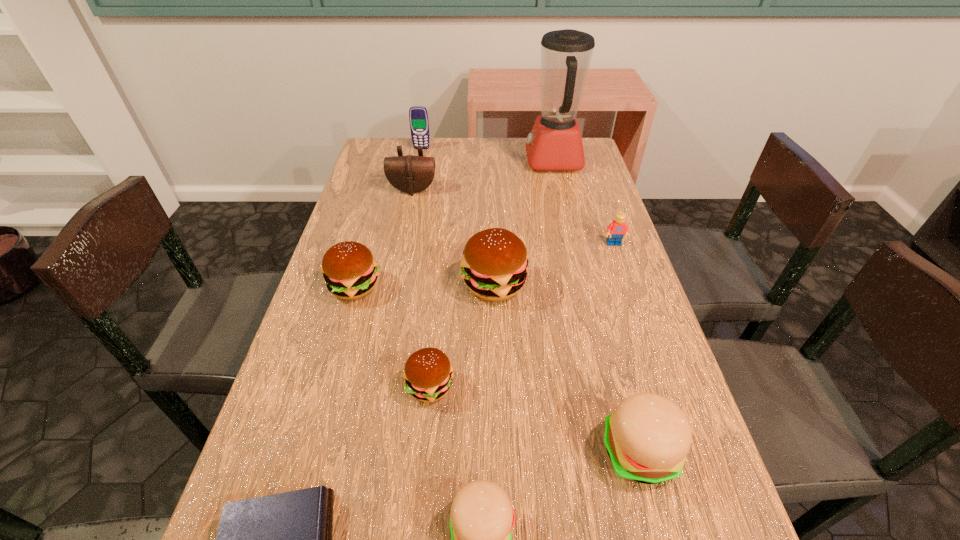
This screenshot has width=960, height=540. What are the coordinates of `the seventh nearest object` in the screenshot? It's located at [617, 228].

You are a GUI agent. You are given a task and a screenshot of the screen. Output one action in this format:
    pyautogui.click(x=<x>, y=<y>)
    Task: Click on the nearest brown hamburger
    The width and height of the screenshot is (960, 540).
    Given the screenshot: What is the action you would take?
    click(x=428, y=374)

The width and height of the screenshot is (960, 540). Find the location of `the smallest brown hamburger`. the smallest brown hamburger is located at coordinates (428, 374).

Where is `free space located on the front of the blender near the controls`? The width and height of the screenshot is (960, 540). free space located on the front of the blender near the controls is located at coordinates (487, 161).

The height and width of the screenshot is (540, 960). What are the coordinates of `blank space located on the front of the blender near the controls` in the screenshot? It's located at (445, 161).

At what (x,y) coordinates should I click in order to perform the action: click on free space located on the front of the blender near the controls. Please return your answer as a coordinate pair (x, y). The image size is (960, 540). Looking at the image, I should click on (443, 161).

The width and height of the screenshot is (960, 540). Identify the location of free spot located 0.390m on the front-facing side of the cellular telephone. (409, 215).

You are a GUI agent. You are given a task and a screenshot of the screen. Output one action in this format:
    pyautogui.click(x=<x>, y=<y>)
    Task: Click on the vacant space located 0.310m on the front of the tallest hamburger
    
    Given the screenshot: What is the action you would take?
    pyautogui.click(x=500, y=439)

This screenshot has width=960, height=540. Find the location of `vacant area situated 0.090m with the flap open on the pouch`. vacant area situated 0.090m with the flap open on the pouch is located at coordinates (408, 214).

Locate an element on the screen. vacant area situated on the front of the second biggest brown hamburger is located at coordinates tap(301, 469).